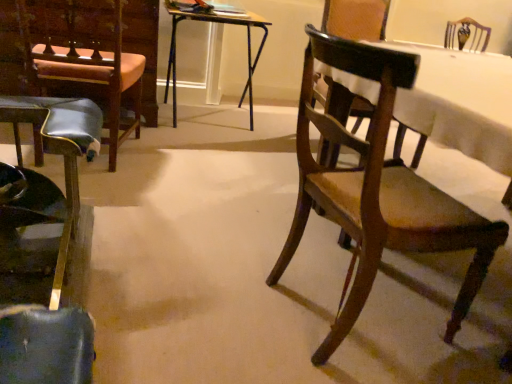
The image size is (512, 384). Find the location of `free spot in front of wooden folding table at center`. free spot in front of wooden folding table at center is located at coordinates (210, 149).